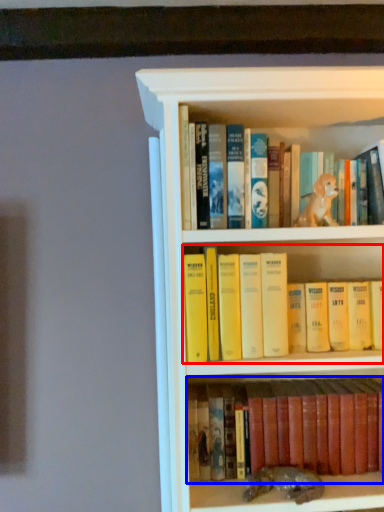
Question: Which of the following is the farthest to the observer, book (highlighted by a red box) or book (highlighted by a blue box)?

Choices:
 (A) book
 (B) book

Answer: (B)